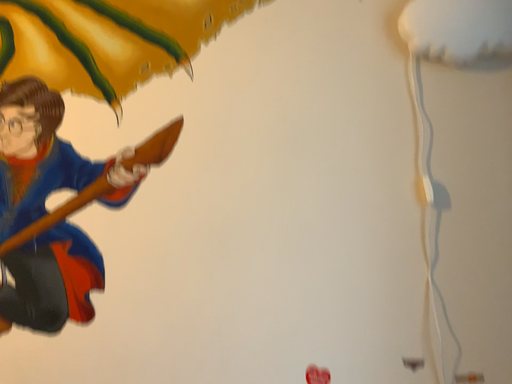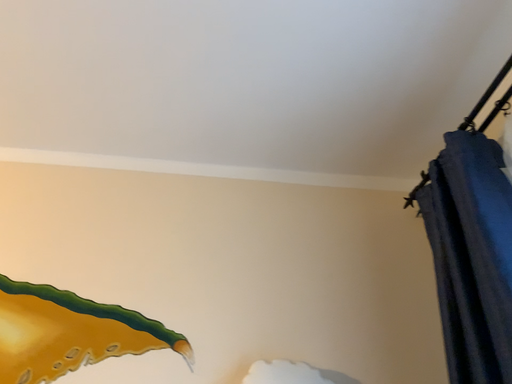
Question: How did the camera likely rotate when shooting the video?

Choices:
 (A) rotated downward
 (B) rotated upward

Answer: (B)